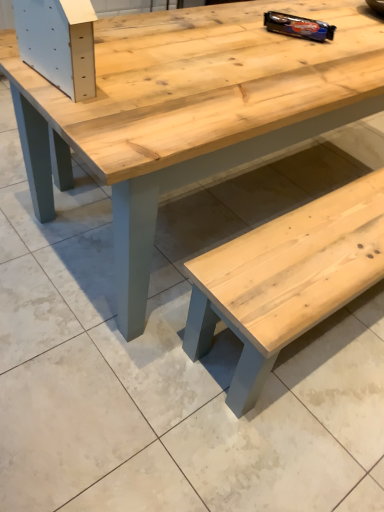
Locate an element on the screen. free space underneath natural wood table at center (from a real-world perspective) is located at coordinates (265, 189).